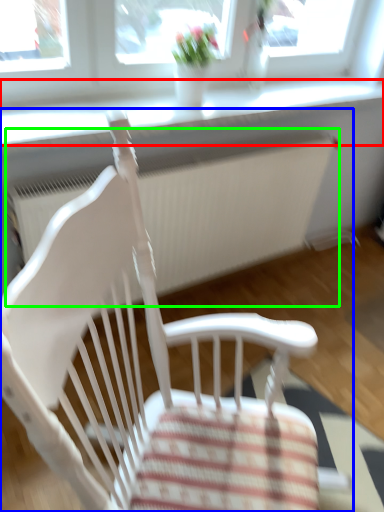
Question: Considering the real-world distances, which object is closest to window sill (highlighted by a red box)? chair (highlighted by a blue box) or radiator (highlighted by a green box).

Choices:
 (A) chair
 (B) radiator

Answer: (B)